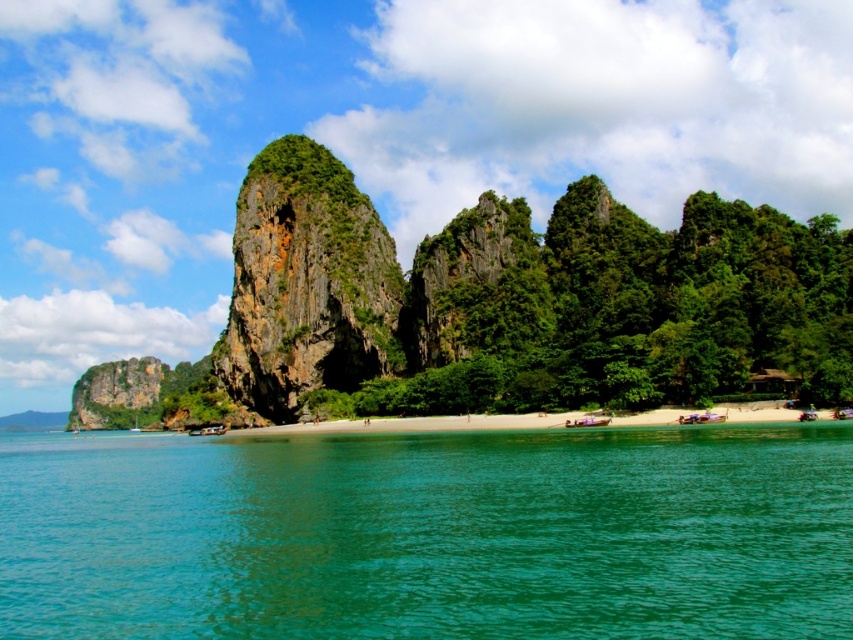
Who is lower down, green textured rock at center or green mossy rock at center?

green mossy rock at center is below.

Who is positioned more to the right, green textured rock at center or green mossy rock at center?

Positioned to the right is green mossy rock at center.

The image size is (853, 640). I want to click on green textured rock at center, so click(306, 284).

Does green water at lower center have a smaller size compared to green textured rock at center?

Incorrect, green water at lower center is not smaller in size than green textured rock at center.

Is green water at lower center closer to the viewer compared to green textured rock at center?

Yes, green water at lower center is in front of green textured rock at center.

Who is more forward, (380,496) or (296,218)?

Positioned in front is point (380,496).

The image size is (853, 640). I want to click on green water at lower center, so click(x=430, y=534).

Which is behind, point (506, 483) or point (548, 422)?

The point (548, 422) is more distant.

Does green water at lower center have a larger size compared to white sand beach at center?

Yes, green water at lower center is bigger than white sand beach at center.

Find the location of `green water at lower center`. green water at lower center is located at coordinates (430, 534).

Locate an element on the screen. The width and height of the screenshot is (853, 640). green water at lower center is located at coordinates pyautogui.click(x=430, y=534).